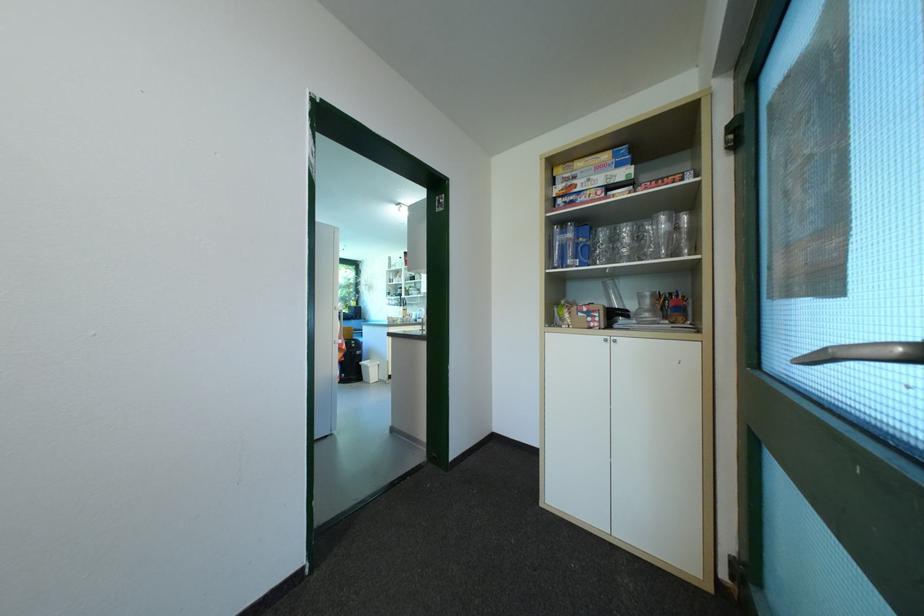
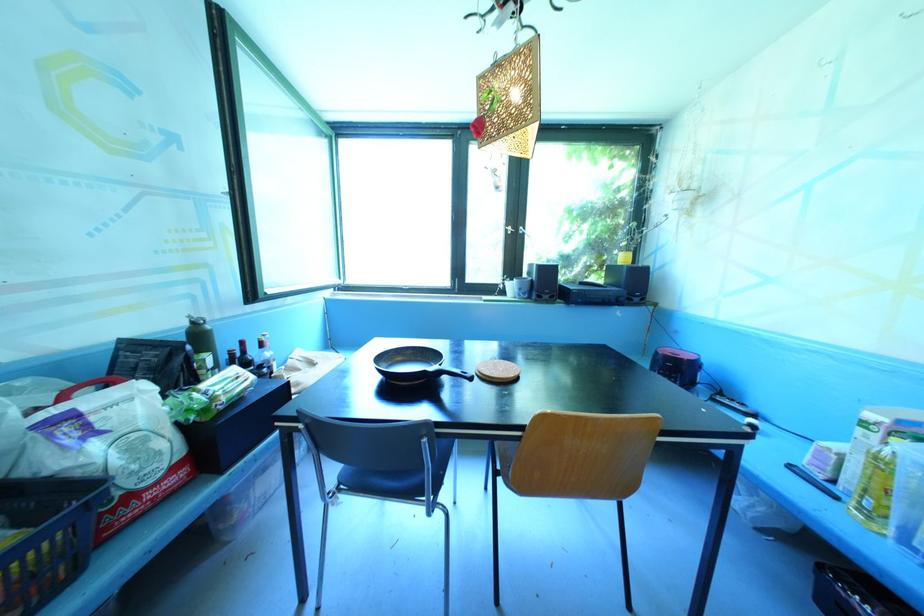
Where in the second image is the point corresponding to point 357,313 from the first image?

(631, 286)